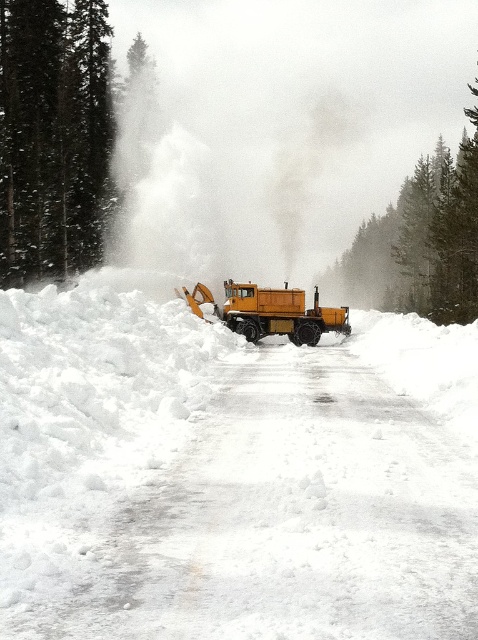
Between white fluffy snow at center and white powdery steam at center, which one appears on the right side from the viewer's perspective?

white fluffy snow at center

Looking at this image, can you confirm if white fluffy snow at center is smaller than white powdery steam at center?

Yes, white fluffy snow at center is smaller than white powdery steam at center.

Does point (446, 376) come in front of point (247, 236)?

Yes, point (446, 376) is in front of point (247, 236).

You are a GUI agent. You are given a task and a screenshot of the screen. Output one action in this format:
    pyautogui.click(x=<x>, y=<y>)
    Task: Click on the white fluffy snow at center
    
    Given the screenshot: What is the action you would take?
    pyautogui.click(x=231, y=476)

In the scene shown: Who is positioned more to the right, white fluffy snow at center or yellow matte truck at center?

yellow matte truck at center

Can you confirm if white fluffy snow at center is positioned above yellow matte truck at center?

No, white fluffy snow at center is not above yellow matte truck at center.

At what (x,y) coordinates should I click in order to perform the action: click on white fluffy snow at center. Please return your answer as a coordinate pair (x, y). Looking at the image, I should click on (231, 476).

Find the location of `white fluffy snow at center`. white fluffy snow at center is located at coordinates (231, 476).

Which is more to the right, white powdery steam at center or yellow matte truck at center?

Positioned to the right is yellow matte truck at center.

Can you confirm if white powdery steam at center is smaller than yellow matte truck at center?

Incorrect, white powdery steam at center is not smaller in size than yellow matte truck at center.

Does point (282, 132) lie behind point (267, 298)?

Yes, point (282, 132) is behind point (267, 298).

The height and width of the screenshot is (640, 478). What are the coordinates of `white powdery steam at center` in the screenshot? It's located at (214, 186).